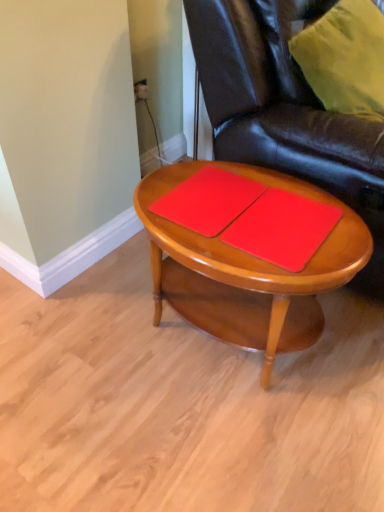
This screenshot has height=512, width=384. What are the coordinates of `vacant area that is situated to the right of red matte notebook at center, acting as the 2th notebook starting from the left` in the screenshot? It's located at point(343,229).